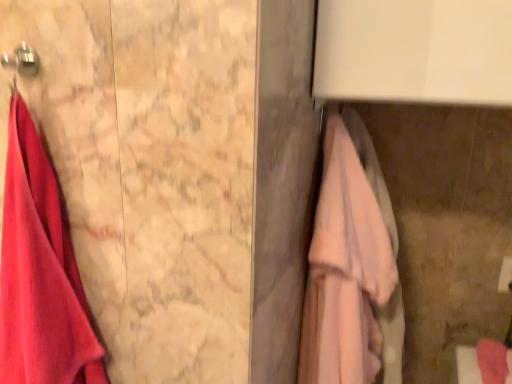
What are the coordinates of `pink fabric towel at right, the second towel viewed from the left` in the screenshot? It's located at (351, 266).

Considering the points (6, 54) and (502, 266), which point is in front, point (6, 54) or point (502, 266)?

The point (6, 54) is closer to the camera.

Is pink fabric towel bar at right located within metallic hook at upper left?

No, pink fabric towel bar at right is not surrounded by metallic hook at upper left.

Could you tell me if metallic hook at upper left is facing pink fabric towel bar at right?

No, metallic hook at upper left does not turn towards pink fabric towel bar at right.

What's the angular difference between pink fabric towel bar at right and matte pink towel at left, the second towel in the right-to-left sequence,'s facing directions?

0.45 degrees separate the facing orientations of pink fabric towel bar at right and matte pink towel at left, the second towel in the right-to-left sequence.

Considering the sizes of objects pink fabric towel bar at right and matte pink towel at left, the second towel in the right-to-left sequence, in the image provided, who is bigger, pink fabric towel bar at right or matte pink towel at left, the second towel in the right-to-left sequence,?

Bigger between the two is matte pink towel at left, the second towel in the right-to-left sequence.

Is pink fabric towel bar at right to the left of matte pink towel at left, the first towel viewed from the left, from the viewer's perspective?

No.

Measure the distance from pink fabric towel bar at right to matte pink towel at left, the first towel viewed from the left.

3.51 feet.

Is metallic hook at upper left far from pink fabric towel at right, the second towel viewed from the left?

That's not correct — metallic hook at upper left is a little close to pink fabric towel at right, the second towel viewed from the left.

Between metallic hook at upper left and pink fabric towel at right, the second towel viewed from the left, which one has larger width?

pink fabric towel at right, the second towel viewed from the left, is wider.

Does point (28, 67) come in front of point (367, 223)?

That is True.

Could you tell me if metallic hook at upper left is facing pink fabric towel at right, which is counted as the first towel, starting from the right?

No.

Is metallic hook at upper left at the back of pink fabric towel bar at right?

No, pink fabric towel bar at right's orientation is not away from metallic hook at upper left.

Is there a large distance between pink fabric towel bar at right and metallic hook at upper left?

pink fabric towel bar at right is far away from metallic hook at upper left.

What's the angular difference between pink fabric towel bar at right and metallic hook at upper left's facing directions?

The facing directions of pink fabric towel bar at right and metallic hook at upper left are 0.45 degrees apart.

Considering the positions of objects pink fabric towel bar at right and metallic hook at upper left in the image provided, who is more to the left, pink fabric towel bar at right or metallic hook at upper left?

Positioned to the left is metallic hook at upper left.

From the image's perspective, is matte pink towel at left, the first towel viewed from the left, over pink fabric towel bar at right?

Indeed, from the image's perspective, matte pink towel at left, the first towel viewed from the left, is shown above pink fabric towel bar at right.

In terms of width, does matte pink towel at left, the first towel viewed from the left, look wider or thinner when compared to pink fabric towel bar at right?

Considering their sizes, matte pink towel at left, the first towel viewed from the left, looks broader than pink fabric towel bar at right.

Considering the relative sizes of matte pink towel at left, the second towel in the right-to-left sequence, and pink fabric towel bar at right in the image provided, is matte pink towel at left, the second towel in the right-to-left sequence, smaller than pink fabric towel bar at right?

No.

Does matte pink towel at left, the second towel in the right-to-left sequence, turn towards pink fabric towel bar at right?

No, matte pink towel at left, the second towel in the right-to-left sequence, does not turn towards pink fabric towel bar at right.

This screenshot has height=384, width=512. Identify the location of towel bar on the right of pink fabric towel at right, which is counted as the first towel, starting from the right. (505, 276).

Are pink fabric towel bar at right and pink fabric towel at right, the second towel viewed from the left, located far from each other?

They are positioned close to each other.

Looking at this image, between pink fabric towel bar at right and pink fabric towel at right, which is counted as the first towel, starting from the right, which one has less height?

With less height is pink fabric towel bar at right.

Does pink fabric towel at right, the second towel viewed from the left, have a lesser height compared to metallic hook at upper left?

No, pink fabric towel at right, the second towel viewed from the left, is not shorter than metallic hook at upper left.

Considering the relative positions of pink fabric towel at right, which is counted as the first towel, starting from the right, and metallic hook at upper left in the image provided, is pink fabric towel at right, which is counted as the first towel, starting from the right, to the right of metallic hook at upper left from the viewer's perspective?

Correct, you'll find pink fabric towel at right, which is counted as the first towel, starting from the right, to the right of metallic hook at upper left.

From the image's perspective, is pink fabric towel at right, the second towel viewed from the left, located above metallic hook at upper left?

No.

At what (x,y) coordinates should I click in order to perform the action: click on hanger above the pink fabric towel bar at right (from a real-world perspective). Please return your answer as a coordinate pair (x, y). Looking at the image, I should click on (22, 60).

At what (x,y) coordinates should I click in order to perform the action: click on towel bar that is below the matte pink towel at left, the second towel in the right-to-left sequence (from the image's perspective). Please return your answer as a coordinate pair (x, y). The width and height of the screenshot is (512, 384). Looking at the image, I should click on (505, 276).

Based on their spatial positions, is pink fabric towel at right, which is counted as the first towel, starting from the right, or matte pink towel at left, the first towel viewed from the left, further from metallic hook at upper left?

pink fabric towel at right, which is counted as the first towel, starting from the right, is positioned further to the anchor metallic hook at upper left.

Considering their positions, is pink fabric towel bar at right positioned closer to metallic hook at upper left than matte pink towel at left, the second towel in the right-to-left sequence?

Among the two, matte pink towel at left, the second towel in the right-to-left sequence, is located nearer to metallic hook at upper left.

Which object lies nearer to the anchor point pink fabric towel at right, which is counted as the first towel, starting from the right, metallic hook at upper left or matte pink towel at left, the first towel viewed from the left?

matte pink towel at left, the first towel viewed from the left, is positioned closer to the anchor pink fabric towel at right, which is counted as the first towel, starting from the right.

Looking at the image, which one is located closer to pink fabric towel bar at right, pink fabric towel at right, which is counted as the first towel, starting from the right, or matte pink towel at left, the second towel in the right-to-left sequence?

pink fabric towel at right, which is counted as the first towel, starting from the right, is closer to pink fabric towel bar at right.

From the image, which object appears to be farther from matte pink towel at left, the second towel in the right-to-left sequence, pink fabric towel bar at right or pink fabric towel at right, the second towel viewed from the left?

pink fabric towel bar at right.

Which object lies nearer to the anchor point matte pink towel at left, the first towel viewed from the left, pink fabric towel bar at right or metallic hook at upper left?

metallic hook at upper left is closer to matte pink towel at left, the first towel viewed from the left.

From the image, which object appears to be nearer to pink fabric towel at right, which is counted as the first towel, starting from the right, pink fabric towel bar at right or matte pink towel at left, the first towel viewed from the left?

pink fabric towel bar at right is closer to pink fabric towel at right, which is counted as the first towel, starting from the right.

Looking at this image, looking at the image, which one is located further to pink fabric towel at right, the second towel viewed from the left, metallic hook at upper left or pink fabric towel bar at right?

The object further to pink fabric towel at right, the second towel viewed from the left, is metallic hook at upper left.

I want to click on towel situated between matte pink towel at left, the first towel viewed from the left, and pink fabric towel bar at right from left to right, so click(351, 266).

You are a GUI agent. You are given a task and a screenshot of the screen. Output one action in this format:
    pyautogui.click(x=<x>, y=<y>)
    Task: Click on the towel between metallic hook at upper left and pink fabric towel bar at right in the horizontal direction
    This screenshot has height=384, width=512.
    Given the screenshot: What is the action you would take?
    pyautogui.click(x=351, y=266)

Where is `hanger located between matte pink towel at left, the second towel in the right-to-left sequence, and pink fabric towel at right, the second towel viewed from the left, in the left-right direction`? hanger located between matte pink towel at left, the second towel in the right-to-left sequence, and pink fabric towel at right, the second towel viewed from the left, in the left-right direction is located at coordinates (22, 60).

Where is `hanger located between matte pink towel at left, the first towel viewed from the left, and pink fabric towel bar at right in the left-right direction`? hanger located between matte pink towel at left, the first towel viewed from the left, and pink fabric towel bar at right in the left-right direction is located at coordinates (22, 60).